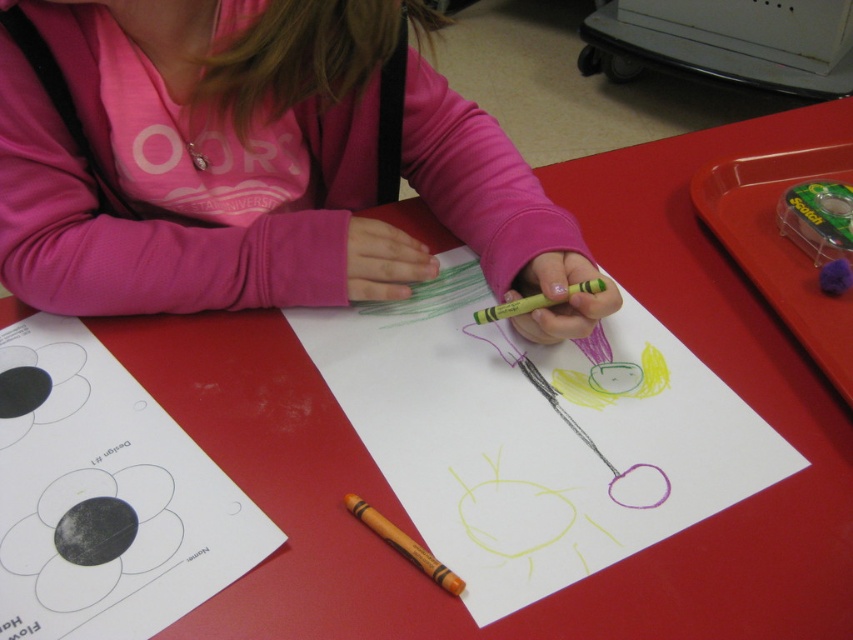
The child is wearing a pink fleece shirt at upper center and using a matte yellow crayon at center. Which item is wider?

The pink fleece shirt at upper center is wider than the matte yellow crayon at center.

Consider the image. You are an observer looking at the child at the red table. The child is wearing a pink fleece shirt at upper center. Where exactly is the pink fleece shirt located on the child?

The pink fleece shirt at upper center is located at point (x=247, y=160), which places it centrally on the child from the observer perspective.